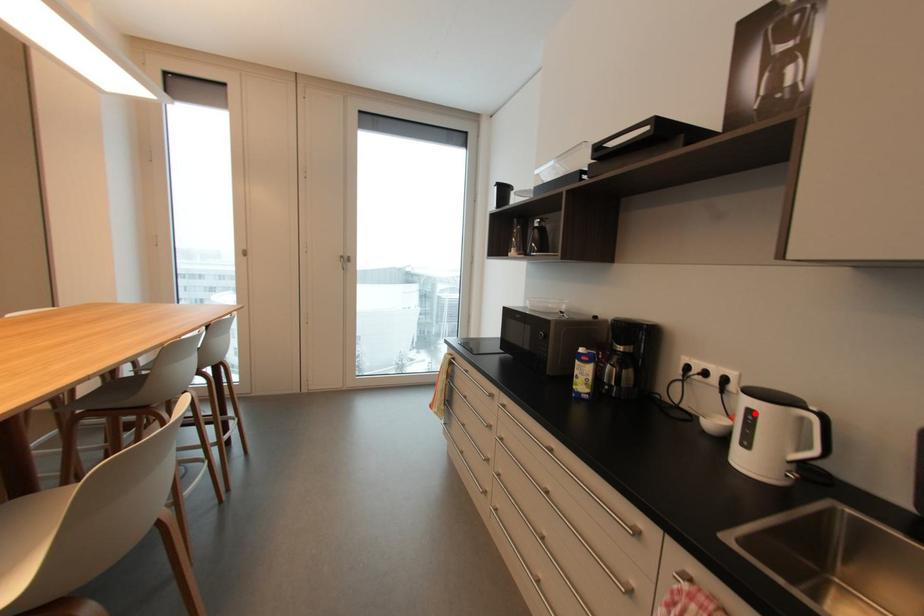
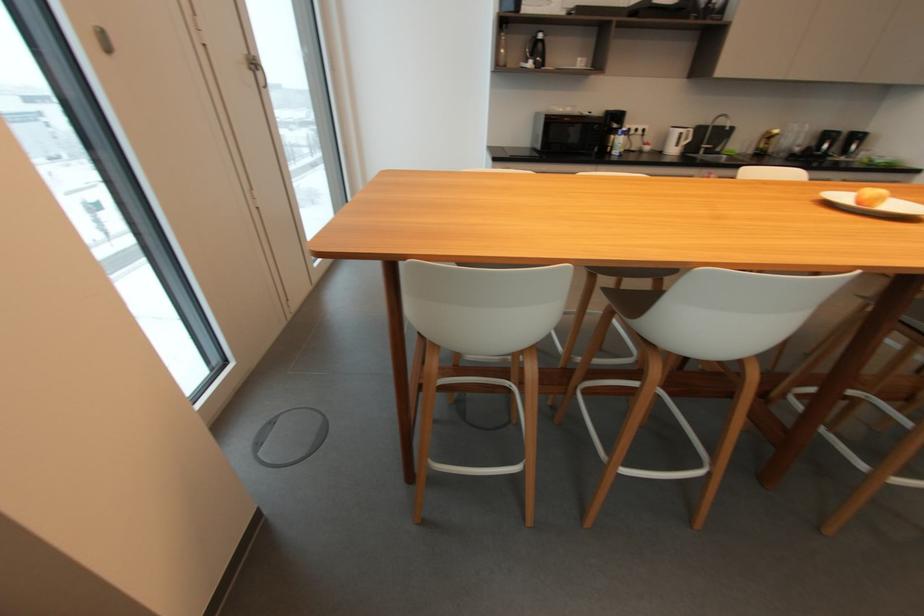
Question: I am providing you with two images of the same scene from different viewpoints. A red point is marked on the first image. At the location where the point appears in image 1, is it still visible in image 2?

Choices:
 (A) Yes
 (B) No

Answer: (A)